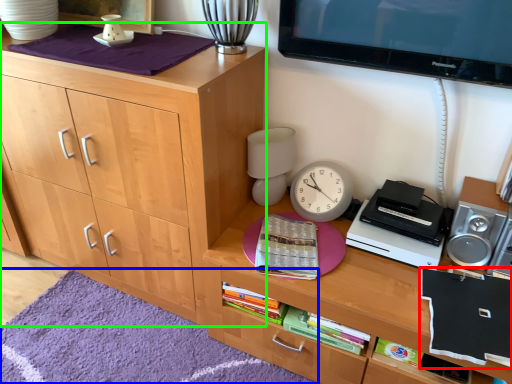
Question: Considering the real-world distances, which object is closest to book (highlighted by a red box)? mat (highlighted by a blue box) or cabinetry (highlighted by a green box).

Choices:
 (A) mat
 (B) cabinetry

Answer: (A)